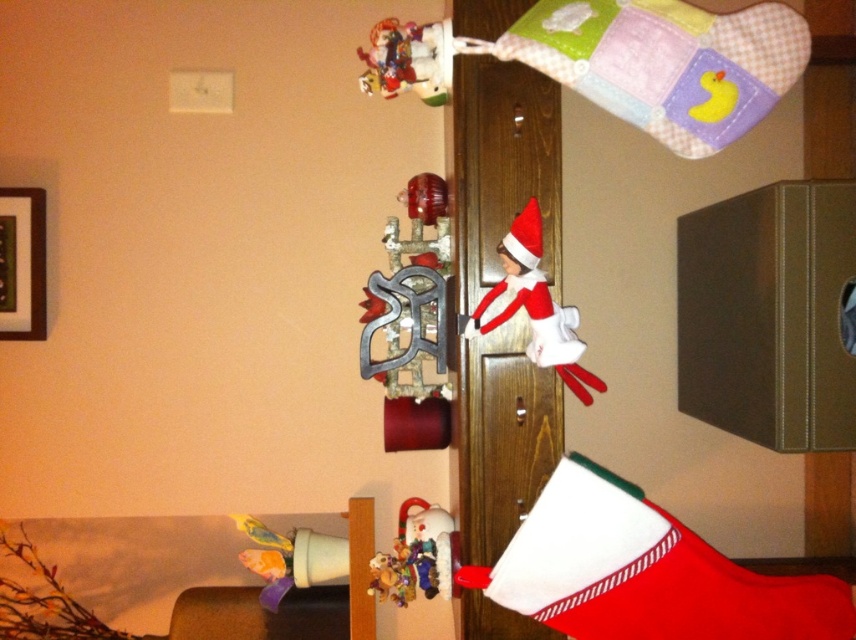
Between metallic silver ornament at upper center and velvety plush teddy bear at center, which one has less height?

Standing shorter between the two is velvety plush teddy bear at center.

Which of these two, metallic silver ornament at upper center or velvety plush teddy bear at center, stands taller?

With more height is metallic silver ornament at upper center.

Find the location of a particular element. The width and height of the screenshot is (856, 640). metallic silver ornament at upper center is located at coordinates (413, 323).

Is metallic silver ornament at upper center above matte plastic toy at lower left?

Yes.

What do you see at coordinates (413, 323) in the screenshot? I see `metallic silver ornament at upper center` at bounding box center [413, 323].

Is point (432, 428) positioned before point (321, 541)?

Yes.

Locate an element on the screen. This screenshot has height=640, width=856. metallic silver ornament at upper center is located at coordinates point(413,323).

Which is more to the left, velvety plush teddy bear at center or matte plastic toy at lower left?

From the viewer's perspective, matte plastic toy at lower left appears more on the left side.

Is velvety plush teddy bear at center above matte plastic toy at lower left?

Correct, velvety plush teddy bear at center is located above matte plastic toy at lower left.

Identify the location of velvety plush teddy bear at center. (415, 556).